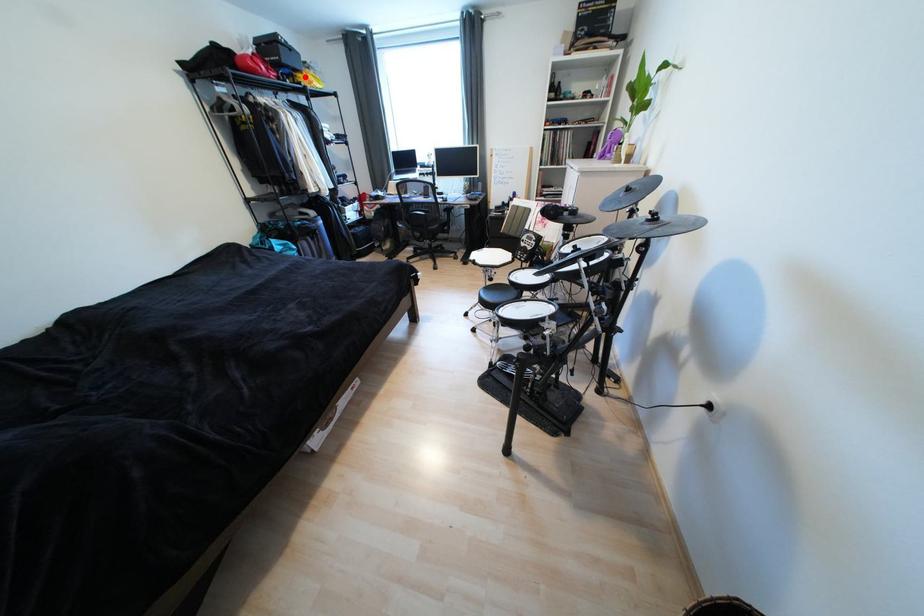
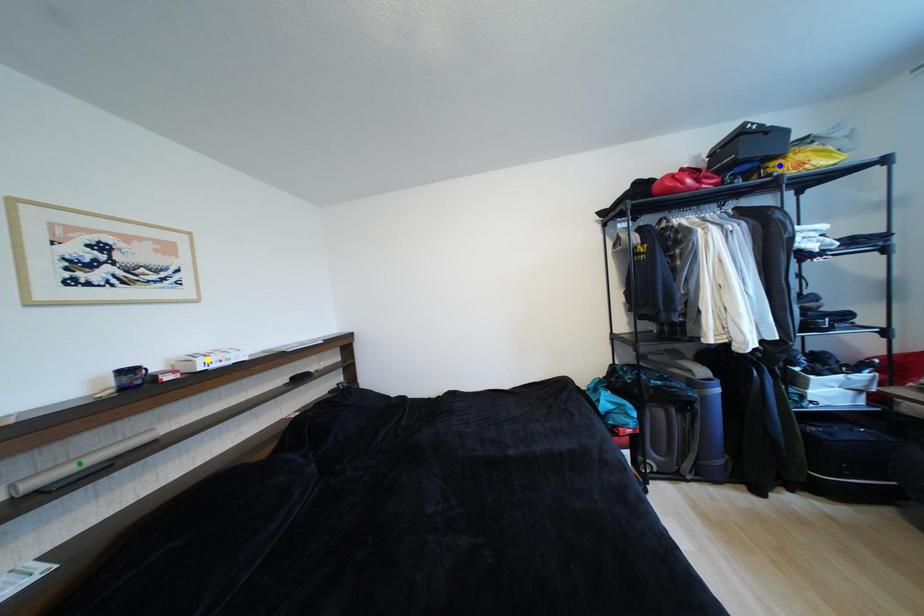
Question: I am providing you with two images of the same scene from different viewpoints. A red point is marked on the first image. You are given multiple points on the second image. In image 2, which mark is for the same physical point as the one in image 1?

Choices:
 (A) blue point
 (B) yellow point
 (C) green point

Answer: (A)